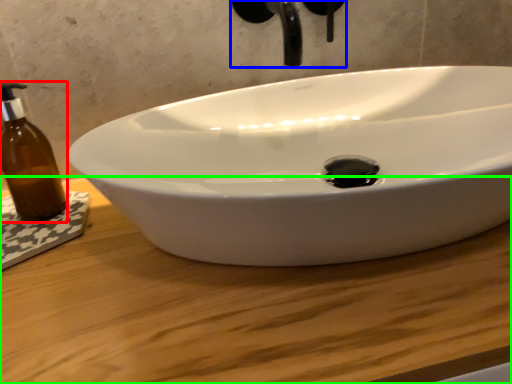
Question: Which is nearer to the bottle (highlighted by a red box)? plumbing fixture (highlighted by a blue box) or counter top (highlighted by a green box).

Choices:
 (A) plumbing fixture
 (B) counter top

Answer: (B)